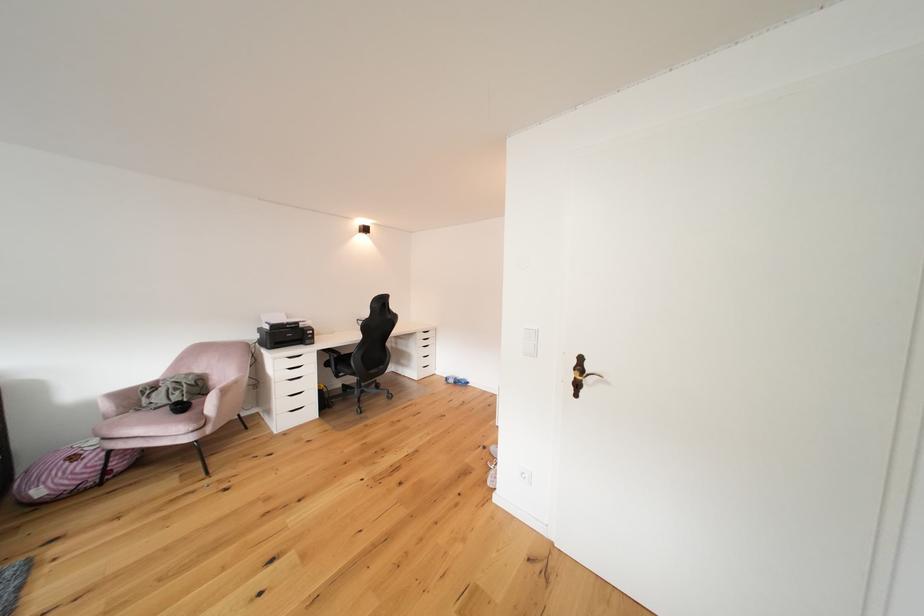
This screenshot has height=616, width=924. Describe the element at coordinates (529, 342) in the screenshot. I see `the white light switch` at that location.